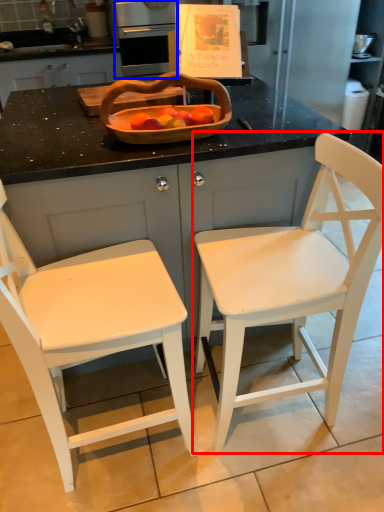
Question: Which object appears farthest to the camera in this image, chair (highlighted by a red box) or kitchen appliance (highlighted by a blue box)?

Choices:
 (A) chair
 (B) kitchen appliance

Answer: (B)